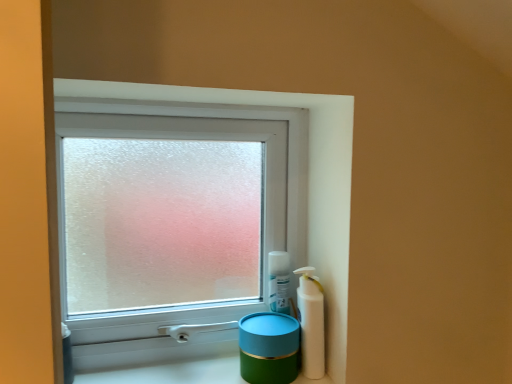
Question: Should I look upward or downward to see teal glossy jar at lower right?

Choices:
 (A) down
 (B) up

Answer: (A)

Question: From the image's perspective, is teal glossy jar at lower right above green matte container at lower center?

Choices:
 (A) no
 (B) yes

Answer: (B)

Question: Are teal glossy jar at lower right and green matte container at lower center far apart?

Choices:
 (A) no
 (B) yes

Answer: (A)

Question: Is teal glossy jar at lower right further to camera compared to green matte container at lower center?

Choices:
 (A) yes
 (B) no

Answer: (A)

Question: Is teal glossy jar at lower right with green matte container at lower center?

Choices:
 (A) no
 (B) yes

Answer: (A)

Question: Is teal glossy jar at lower right thinner than green matte container at lower center?

Choices:
 (A) yes
 (B) no

Answer: (A)

Question: Is teal glossy jar at lower right outside green matte container at lower center?

Choices:
 (A) yes
 (B) no

Answer: (A)

Question: From a real-world perspective, is frosted glass window at center positioned under white plastic bottle at right based on gravity?

Choices:
 (A) yes
 (B) no

Answer: (B)

Question: Is frosted glass window at center oriented away from white plastic bottle at right?

Choices:
 (A) yes
 (B) no

Answer: (B)

Question: Is there a large distance between frosted glass window at center and white plastic bottle at right?

Choices:
 (A) no
 (B) yes

Answer: (A)

Question: Does frosted glass window at center have a smaller size compared to white plastic bottle at right?

Choices:
 (A) no
 (B) yes

Answer: (A)

Question: Could you tell me if frosted glass window at center is turned towards white plastic bottle at right?

Choices:
 (A) no
 (B) yes

Answer: (B)

Question: Can you confirm if frosted glass window at center is positioned to the left of white plastic bottle at right?

Choices:
 (A) yes
 (B) no

Answer: (A)

Question: Is green matte container at lower center located outside white plastic bottle at right?

Choices:
 (A) no
 (B) yes

Answer: (B)